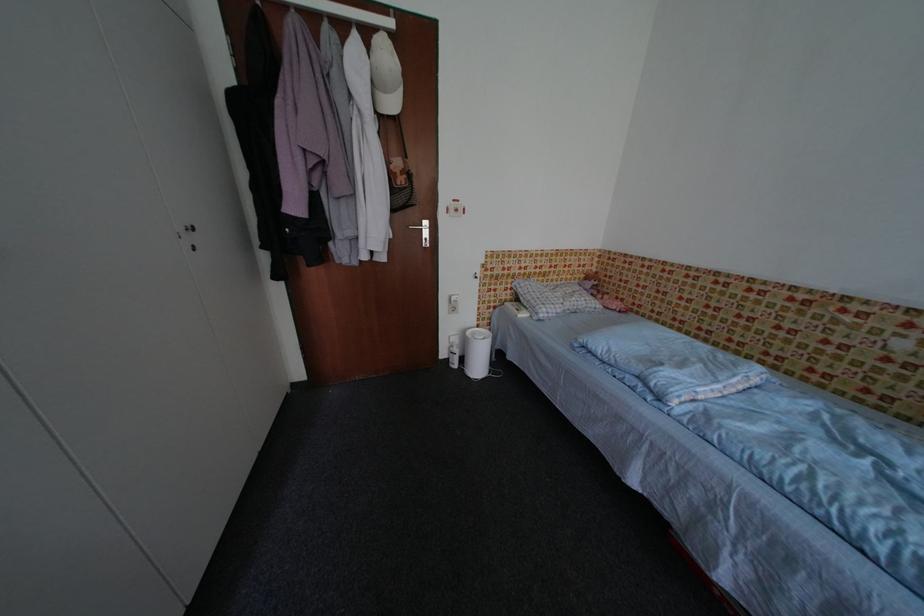
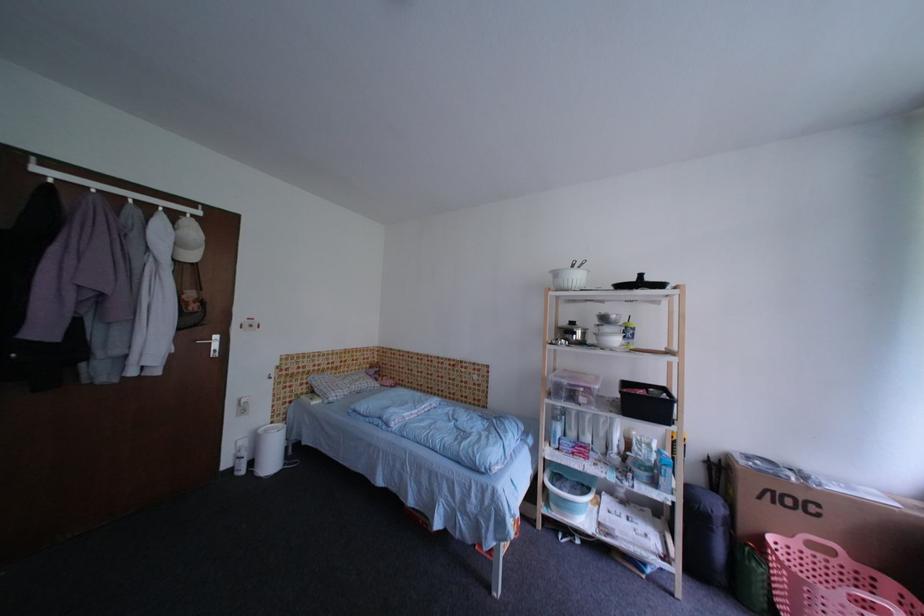
First-person continuous shooting, in which direction is the camera rotating?

The camera rotated toward right-up.